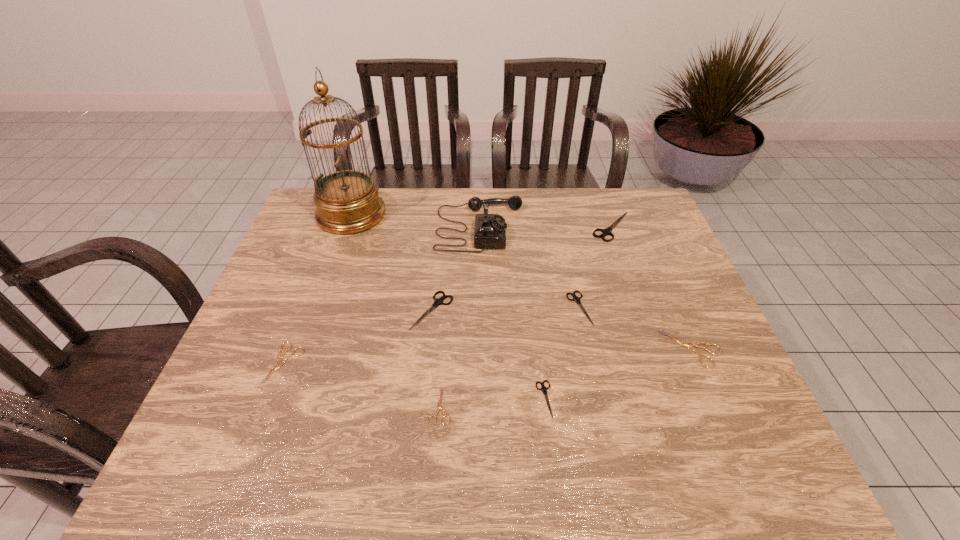
At what (x,y) coordinates should I click in order to perform the action: click on the leftmost shears. Please return your answer as a coordinate pair (x, y). Looking at the image, I should click on (279, 357).

In order to click on the second biggest beige shears in this screenshot , I will do `click(279, 357)`.

Where is `the fourth shears from right to left`? the fourth shears from right to left is located at coordinates (544, 389).

The height and width of the screenshot is (540, 960). I want to click on the nearest black shears, so click(x=544, y=389).

The image size is (960, 540). Identify the location of the second beige shears from left to right. (439, 406).

Where is `the shortest object`? The height and width of the screenshot is (540, 960). the shortest object is located at coordinates (439, 406).

At what (x,y) coordinates should I click in order to perform the action: click on vacant region located 0.340m with an open door on the golden birdcage. Please return your answer as a coordinate pair (x, y). Image resolution: width=960 pixels, height=540 pixels. Looking at the image, I should click on (489, 214).

Locate an element on the screen. The height and width of the screenshot is (540, 960). free region located on the dial of the second tallest object is located at coordinates (555, 227).

I want to click on free spot located 0.370m on the front of the farthest shears, so click(x=650, y=338).

Identify the location of free region located on the front of the leftmost black shears. (420, 432).